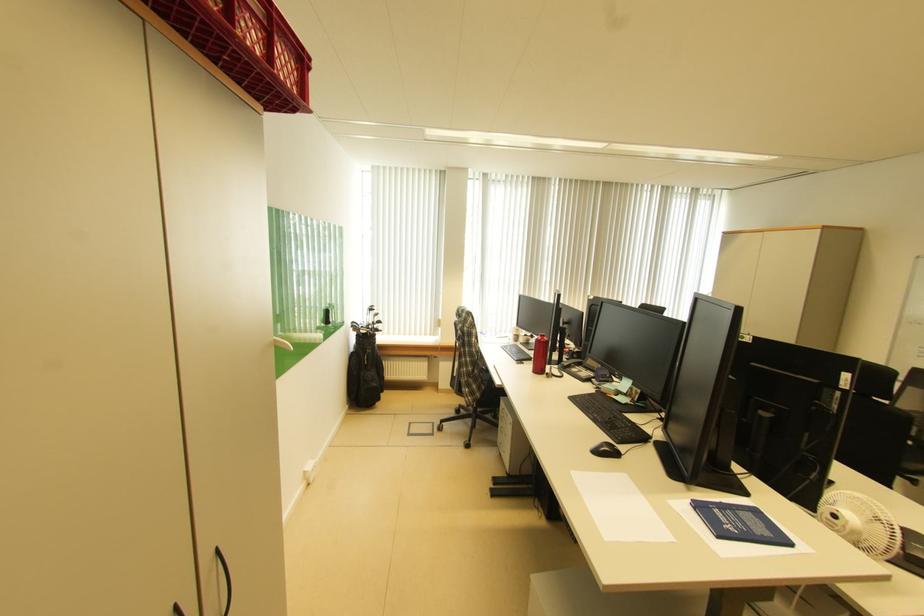
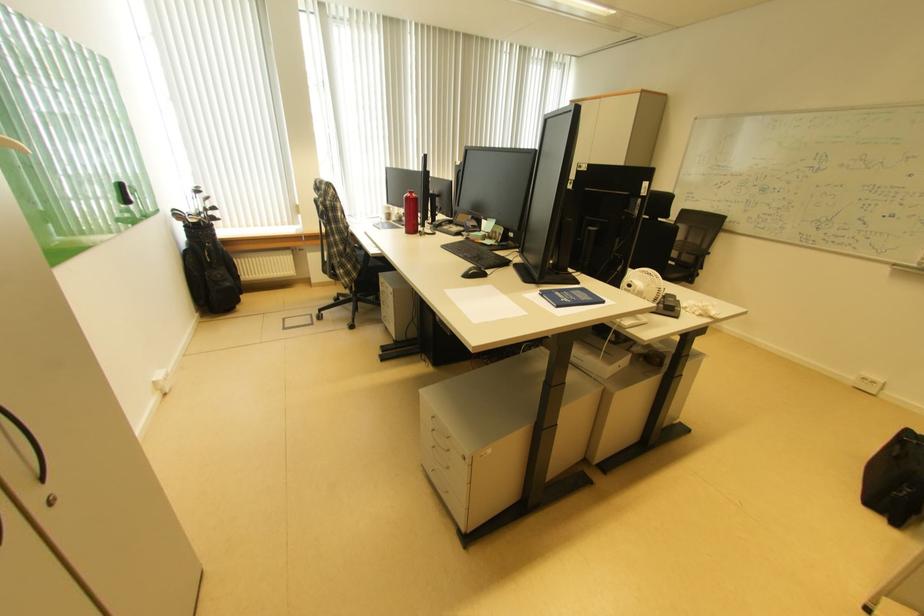
Where in the second image is the point corresponding to pixel 582 400 from the first image?

(455, 249)